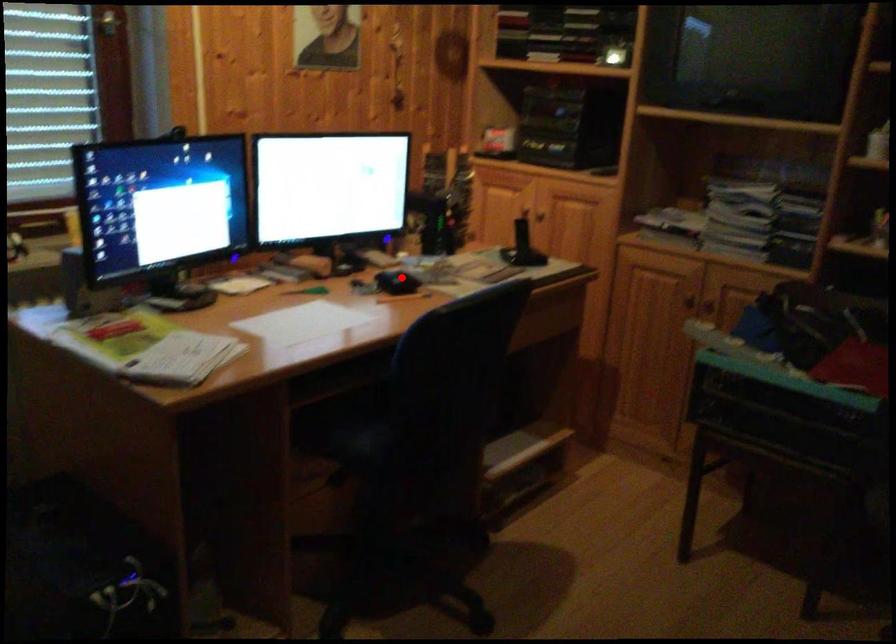
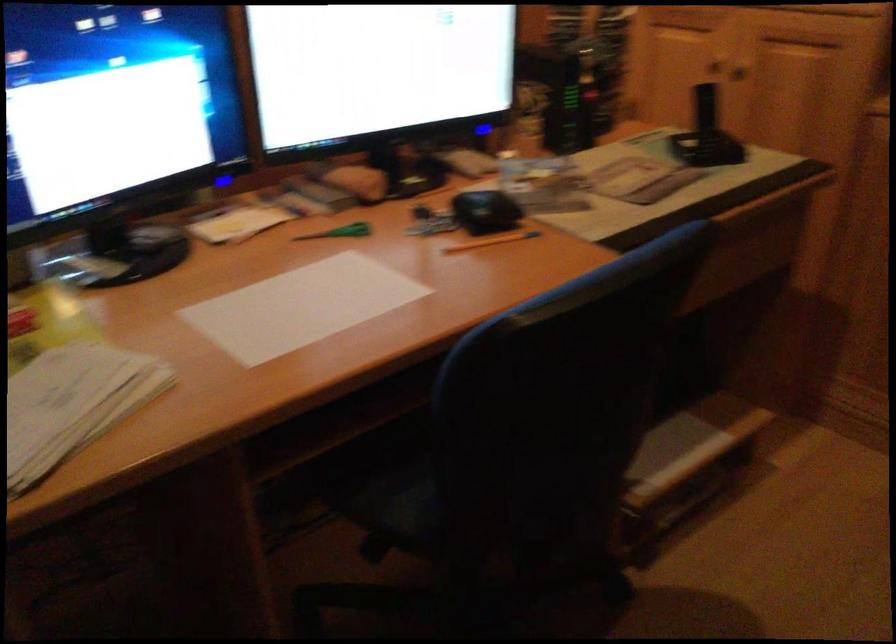
In the second image, find the point that corresponds to the highlighted location in the first image.

(486, 211)